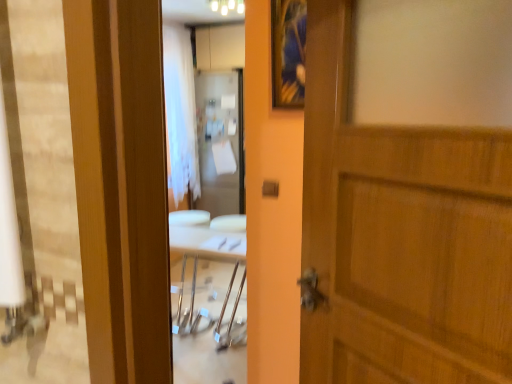
Question: From a real-world perspective, is wooden door at center under wooden framed picture at upper center?

Choices:
 (A) no
 (B) yes

Answer: (B)

Question: Does wooden door at center have a smaller size compared to wooden framed picture at upper center?

Choices:
 (A) no
 (B) yes

Answer: (A)

Question: Is wooden door at center far from wooden framed picture at upper center?

Choices:
 (A) no
 (B) yes

Answer: (A)

Question: Is wooden door at center thinner than wooden framed picture at upper center?

Choices:
 (A) no
 (B) yes

Answer: (A)

Question: Is wooden door at center bigger than wooden framed picture at upper center?

Choices:
 (A) yes
 (B) no

Answer: (A)

Question: Is wooden door at center looking in the opposite direction of wooden framed picture at upper center?

Choices:
 (A) no
 (B) yes

Answer: (A)

Question: Does wooden framed picture at upper center have a larger size compared to wooden door at center?

Choices:
 (A) yes
 (B) no

Answer: (B)

Question: Would you say wooden door at center is part of wooden framed picture at upper center's contents?

Choices:
 (A) no
 (B) yes

Answer: (A)

Question: Can you confirm if wooden framed picture at upper center is thinner than wooden door at center?

Choices:
 (A) yes
 (B) no

Answer: (A)

Question: Is wooden framed picture at upper center at the right side of wooden door at center?

Choices:
 (A) yes
 (B) no

Answer: (B)

Question: From a real-world perspective, is wooden framed picture at upper center physically below wooden door at center?

Choices:
 (A) no
 (B) yes

Answer: (A)

Question: Is wooden framed picture at upper center shorter than wooden door at center?

Choices:
 (A) yes
 (B) no

Answer: (A)

Question: Is white glossy light fixture at upper center positioned far away from white sheer curtain at center?

Choices:
 (A) yes
 (B) no

Answer: (A)